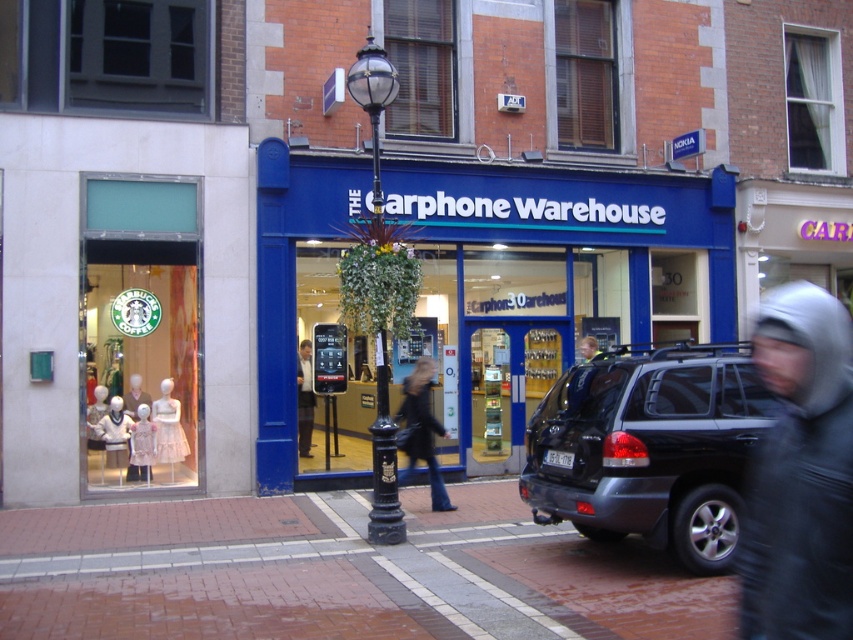
You are a delivery person needing to place a package on the matte black phone at center. Your delivery cart is 10 feet long. Can you maneuver your cart between the dark gray suv at right and the nearest building without hitting anything?

The distance between the dark gray suv at right and the nearest building is 22.22 feet. Since your cart is 10 feet long, there is enough space to maneuver safely without hitting anything.